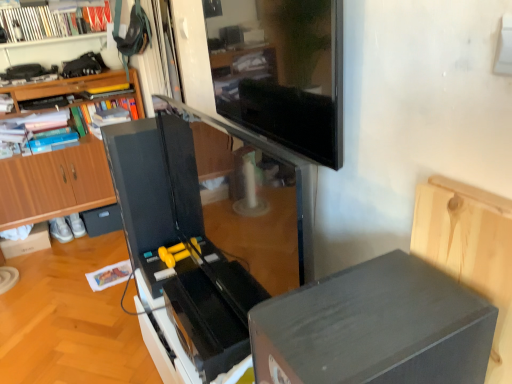
Where is `space that is in front of matte black drawer at lower left`? This screenshot has height=384, width=512. space that is in front of matte black drawer at lower left is located at coordinates (92, 246).